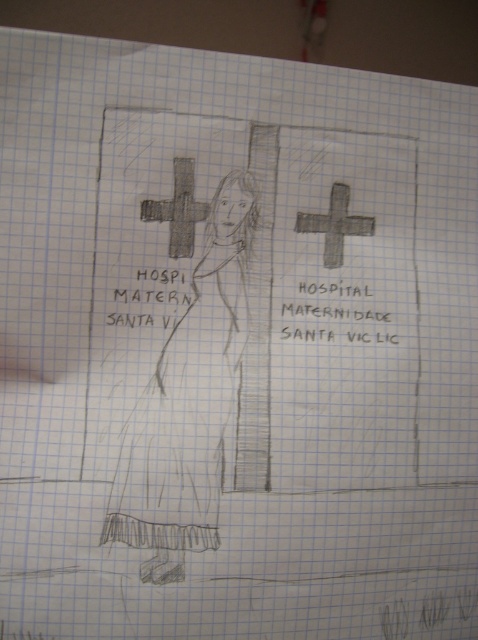
Based on the scene description, where is the matte black dress at center located in relation to the charcoal textured cross at center?

The matte black dress at center is to the right of the charcoal textured cross at center.

You are an artist who needs to add a small detail between the matte black dress at center and the gray textured cross at center in the drawing. Given that the available space between them is 5.69 inches, can you fit a 3.5 inch wide design element there?

The space between the matte black dress at center and the gray textured cross at center is 5.69 inches, so yes, a 3.5 inch wide design element can fit since it is narrower than the available space.

You are an artist trying to replicate the drawing. You want to ensure the charcoal textured cross at center and the gray textured cross at center are proportionally accurate. Which cross should you make wider when drawing them?

The gray textured cross at center should be made wider since its width is greater than the charcoal textured cross at center according to the description.